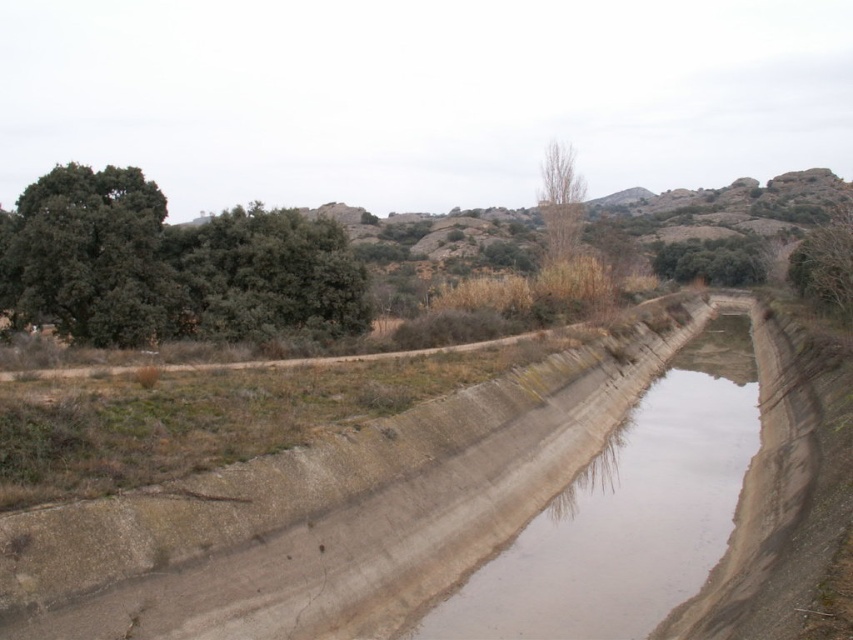
Between green leafy tree at upper left and green matte tree at upper left, which one has more height?

green leafy tree at upper left

Can you confirm if green leafy tree at upper left is positioned above green matte tree at upper left?

No, green leafy tree at upper left is not above green matte tree at upper left.

Which is in front, point (84, 296) or point (91, 332)?

Point (84, 296)

Where is `green leafy tree at upper left`? green leafy tree at upper left is located at coordinates coord(170,266).

Between green leafy tree at left and bare wood tree at center, which one is positioned lower?

green leafy tree at left is lower down.

The width and height of the screenshot is (853, 640). I want to click on green leafy tree at left, so click(x=265, y=276).

This screenshot has height=640, width=853. Find the location of `green leafy tree at left`. green leafy tree at left is located at coordinates (265, 276).

Does green leafy tree at upper right have a smaller size compared to green leafy tree at upper center?

Actually, green leafy tree at upper right might be larger than green leafy tree at upper center.

Who is positioned more to the left, green leafy tree at upper right or green leafy tree at upper center?

Positioned to the left is green leafy tree at upper center.

Describe the element at coordinates (827, 262) in the screenshot. I see `green leafy tree at upper right` at that location.

Find the location of a particular element. This screenshot has width=853, height=640. green leafy tree at upper right is located at coordinates (827, 262).